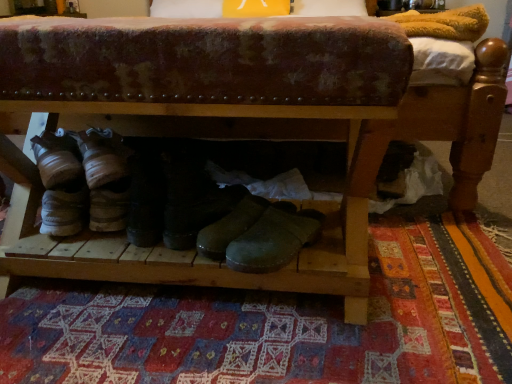
Question: Can you confirm if black leather boots at center, which is the first footwear in left-to-right order, is taller than patchwork rug at center?

Choices:
 (A) no
 (B) yes

Answer: (B)

Question: Does black leather boots at center, the 2th footwear in the right-to-left sequence, have a lesser width compared to patchwork rug at center?

Choices:
 (A) yes
 (B) no

Answer: (A)

Question: Is black leather boots at center, which is the first footwear in left-to-right order, further to camera compared to patchwork rug at center?

Choices:
 (A) yes
 (B) no

Answer: (A)

Question: Does black leather boots at center, which is the first footwear in left-to-right order, have a greater width compared to patchwork rug at center?

Choices:
 (A) yes
 (B) no

Answer: (B)

Question: From a real-world perspective, is black leather boots at center, the 2th footwear in the right-to-left sequence, under patchwork rug at center?

Choices:
 (A) no
 (B) yes

Answer: (A)

Question: Could you tell me if black leather boots at center, which is the first footwear in left-to-right order, is turned towards patchwork rug at center?

Choices:
 (A) yes
 (B) no

Answer: (B)

Question: From the image's perspective, is patchwork rug at center over green leather boot at center, which is the 1th footwear from right to left?

Choices:
 (A) yes
 (B) no

Answer: (B)

Question: Is patchwork rug at center positioned far away from green leather boot at center, which is the 1th footwear from right to left?

Choices:
 (A) yes
 (B) no

Answer: (B)

Question: Can you confirm if patchwork rug at center is smaller than green leather boot at center, placed as the second footwear when sorted from left to right?

Choices:
 (A) yes
 (B) no

Answer: (B)

Question: Is patchwork rug at center outside of green leather boot at center, which is the 1th footwear from right to left?

Choices:
 (A) yes
 (B) no

Answer: (A)

Question: Is patchwork rug at center positioned before green leather boot at center, placed as the second footwear when sorted from left to right?

Choices:
 (A) yes
 (B) no

Answer: (A)

Question: From a real-world perspective, is patchwork rug at center positioned under green leather boot at center, placed as the second footwear when sorted from left to right, based on gravity?

Choices:
 (A) no
 (B) yes

Answer: (B)

Question: Could you tell me if green leather boot at center, which is the 1th footwear from right to left, is facing black leather boots at center, which is the first footwear in left-to-right order?

Choices:
 (A) yes
 (B) no

Answer: (B)